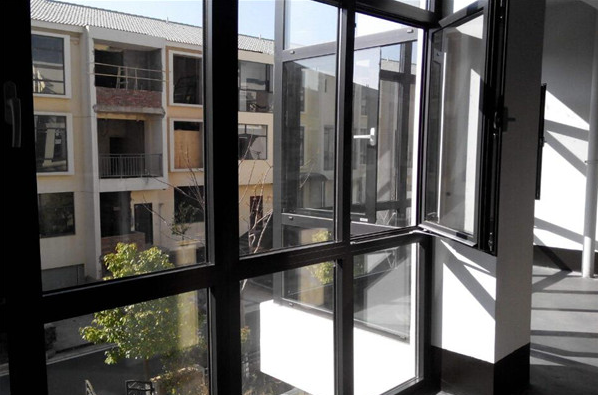
Identify the location of boarded up wooden window. (180, 148).